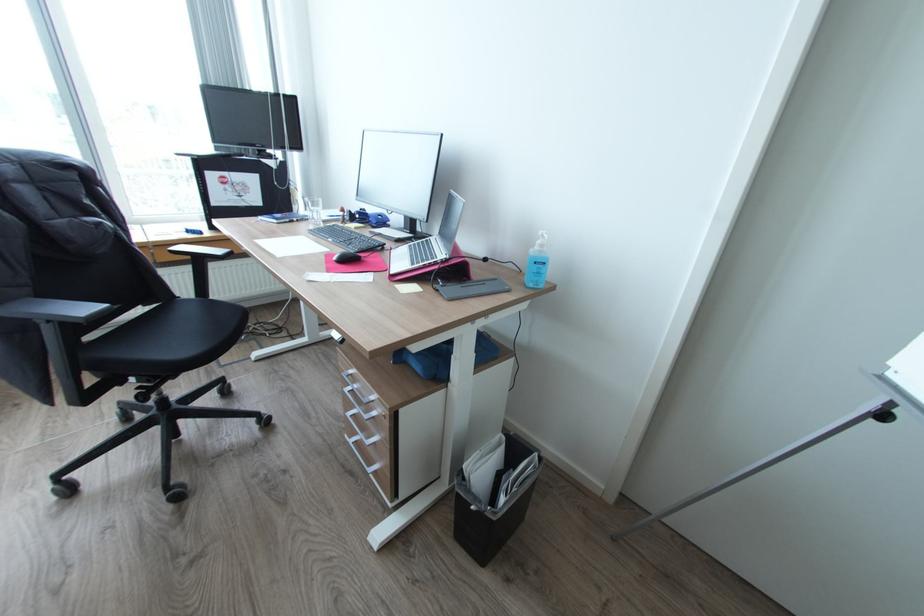
What do you see at coordinates (167, 338) in the screenshot? I see `the black chair sitting surface` at bounding box center [167, 338].